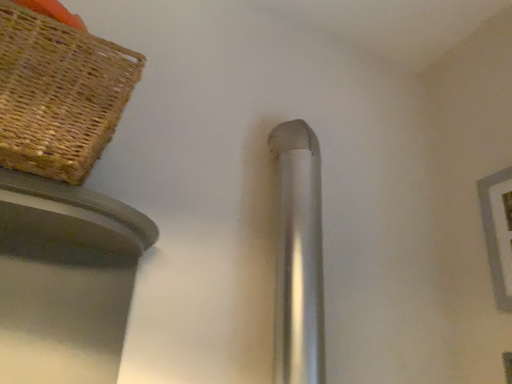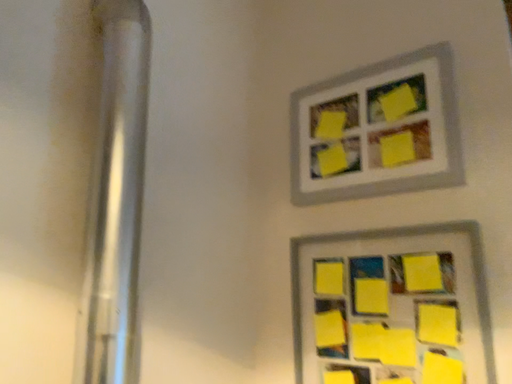
Question: Which way did the camera rotate in the video?

Choices:
 (A) rotated right
 (B) rotated left

Answer: (A)